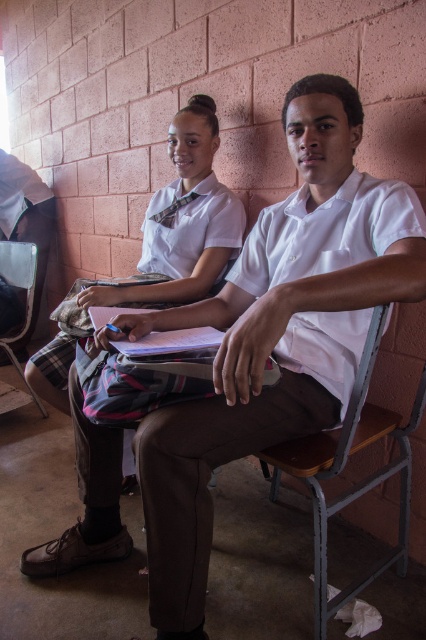
Which is in front, point (345, 451) or point (28, 259)?

Point (345, 451) is more forward.

Is point (368, 440) farther from camera compared to point (14, 244)?

No, (368, 440) is closer to viewer.

Identify the location of wooden seat at lower right. The height and width of the screenshot is (640, 426). (342, 468).

Is wooden seat at lower right further to the viewer compared to white glossy shirt at upper center?

No, it is in front of white glossy shirt at upper center.

Does point (342, 433) come farther from viewer compared to point (143, 230)?

No, it is not.

At what (x,y) coordinates should I click in order to perform the action: click on wooden seat at lower right. Please return your answer as a coordinate pair (x, y). Looking at the image, I should click on (342, 468).

Is point (215, 211) positioned behind point (20, 394)?

No.

Which of these two, white glossy shirt at upper center or metallic gray chair at lower left, stands shorter?

With less height is white glossy shirt at upper center.

Is point (210, 211) in front of point (11, 246)?

Yes, point (210, 211) is closer to viewer.

You are a GUI agent. You are given a task and a screenshot of the screen. Output one action in this format:
    pyautogui.click(x=<x>, y=<y>)
    Task: Click on the white glossy shirt at upper center
    Image resolution: width=426 pixels, height=640 pixels.
    Given the screenshot: What is the action you would take?
    pyautogui.click(x=181, y=244)